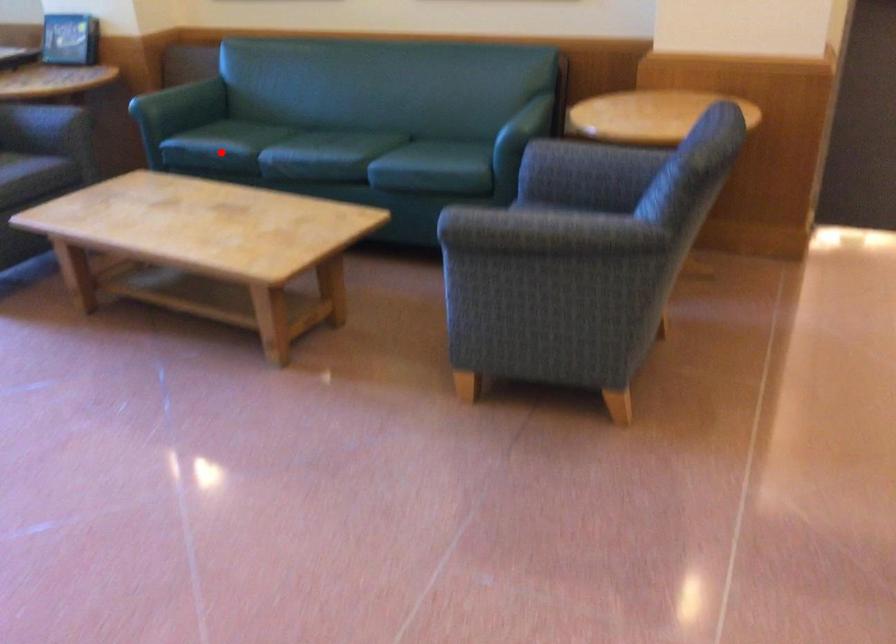
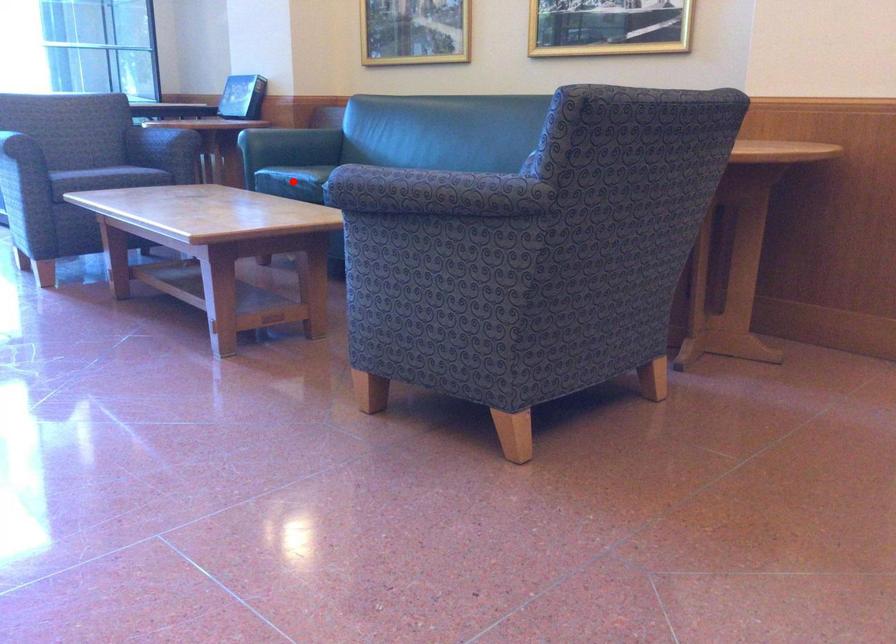
I am providing you with two images of the same scene from different viewpoints. A red point is marked on the first image and another point is marked on the second image. Do the highlighted points in image1 and image2 indicate the same real-world spot?

Yes